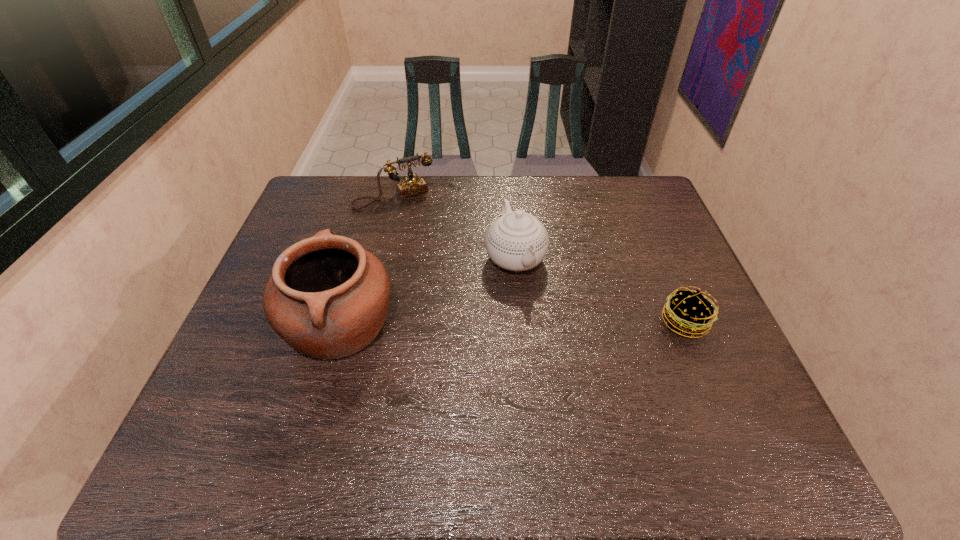
You are a GUI agent. You are given a task and a screenshot of the screen. Output one action in this format:
    pyautogui.click(x=<x>, y=<y>)
    Task: Click on the free spot between the farthest object and the third shortest object
    This screenshot has width=960, height=540.
    Given the screenshot: What is the action you would take?
    pyautogui.click(x=455, y=227)

Where is `free spot between the pottery and the patty`? The width and height of the screenshot is (960, 540). free spot between the pottery and the patty is located at coordinates (513, 323).

The image size is (960, 540). I want to click on free space that is in between the chinaware and the third tallest object, so click(455, 227).

At what (x,y) coordinates should I click in order to perform the action: click on object that is the third closest one to the third object from left to right. Please return your answer as a coordinate pair (x, y). This screenshot has height=540, width=960. Looking at the image, I should click on (689, 312).

The image size is (960, 540). Find the location of `the closest object to the rightmost object`. the closest object to the rightmost object is located at coordinates (517, 241).

The height and width of the screenshot is (540, 960). Find the location of `free space that satisfies the following two spatial constraints: 1. on the front side of the chinaware; 2. on the right side of the telephone`. free space that satisfies the following two spatial constraints: 1. on the front side of the chinaware; 2. on the right side of the telephone is located at coordinates (379, 258).

At what (x,y) coordinates should I click in order to perform the action: click on vacant space that satisfies the following two spatial constraints: 1. on the front side of the patty; 2. on the right side of the second shortest object. Please return your answer as a coordinate pair (x, y). Looking at the image, I should click on (364, 322).

Where is `vacant space that satisfies the following two spatial constraints: 1. on the back side of the shortest object; 2. on the right side of the tallest object`? This screenshot has height=540, width=960. vacant space that satisfies the following two spatial constraints: 1. on the back side of the shortest object; 2. on the right side of the tallest object is located at coordinates (341, 322).

Identify the location of free space that satisfies the following two spatial constraints: 1. on the front side of the rightmost object; 2. on the right side of the telephone. The width and height of the screenshot is (960, 540). (364, 322).

Locate an element on the screen. The image size is (960, 540). vacant region that satisfies the following two spatial constraints: 1. on the back side of the second shortest object; 2. on the left side of the pottery is located at coordinates (376, 197).